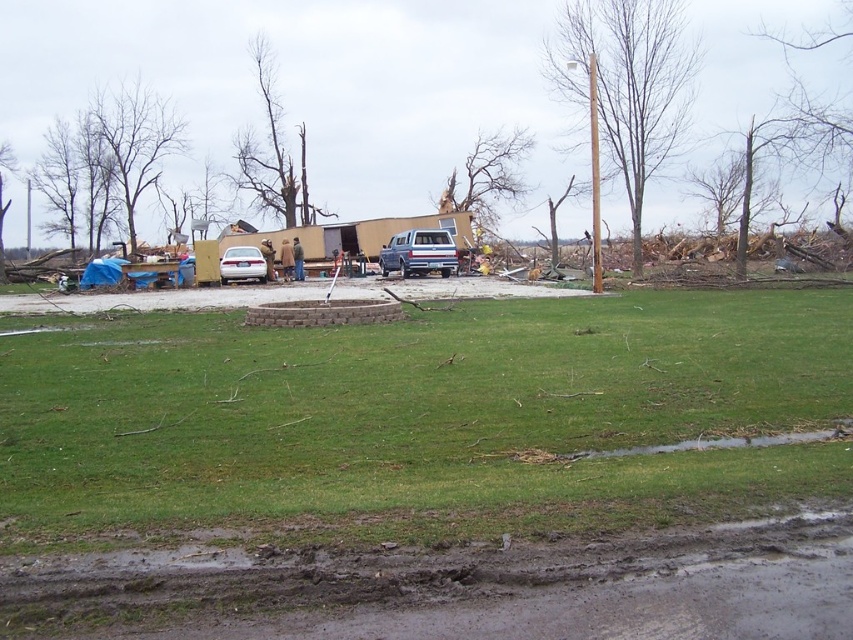
Question: Does green grass at center lie in front of silver metallic sedan at center?

Choices:
 (A) no
 (B) yes

Answer: (B)

Question: In this image, where is green grass at center located relative to silver metallic sedan at center?

Choices:
 (A) right
 (B) left

Answer: (A)

Question: Which point appears farthest from the camera in this image?

Choices:
 (A) (315, 385)
 (B) (399, 266)
 (C) (347, 611)

Answer: (B)

Question: Is muddy dirt at lower center below silver metallic sedan at center?

Choices:
 (A) no
 (B) yes

Answer: (B)

Question: Which point is closer to the camera?

Choices:
 (A) muddy dirt at lower center
 (B) green grass at center

Answer: (A)

Question: Among these points, which one is nearest to the camera?

Choices:
 (A) (784, 525)
 (B) (492, 385)
 (C) (233, 280)

Answer: (A)